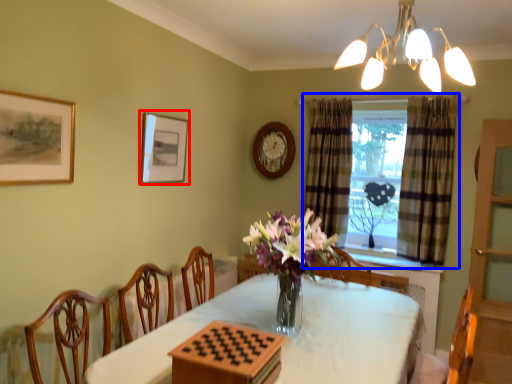
Question: Which object is further to the camera taking this photo, picture frame (highlighted by a red box) or window (highlighted by a blue box)?

Choices:
 (A) picture frame
 (B) window

Answer: (B)